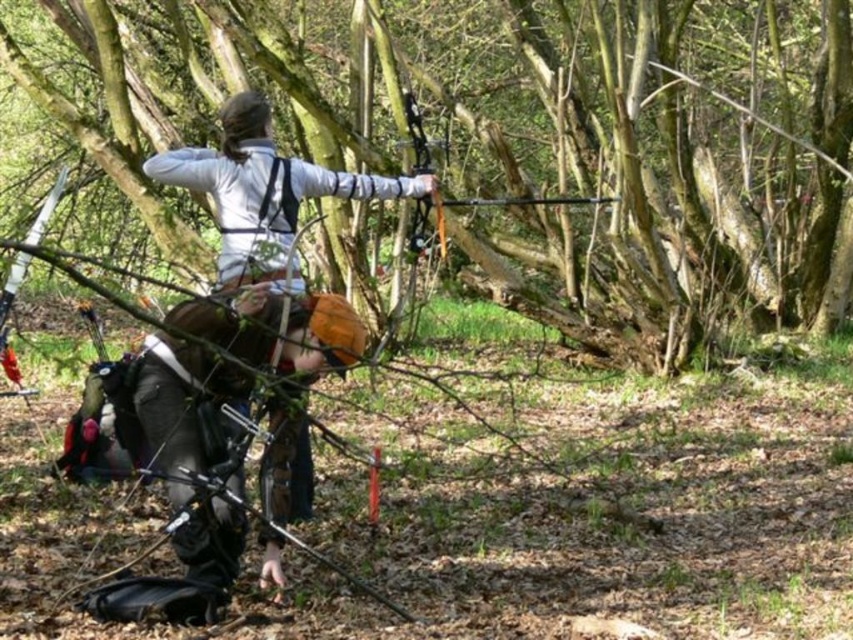
Is rough bark tree at center above matte white jacket at center?

Indeed, rough bark tree at center is positioned over matte white jacket at center.

Identify the location of rough bark tree at center. tap(519, 141).

Measure the distance between brown leather backpack at center and matte black bow at center.

brown leather backpack at center is 2.58 meters away from matte black bow at center.

Is brown leather backpack at center bigger than matte black bow at center?

Correct, brown leather backpack at center is larger in size than matte black bow at center.

What are the coordinates of `brown leather backpack at center` in the screenshot? It's located at (183, 401).

The image size is (853, 640). I want to click on brown leather backpack at center, so (183, 401).

Between brown leather backpack at center and matte white jacket at center, which one appears on the right side from the viewer's perspective?

matte white jacket at center is more to the right.

Does brown leather backpack at center have a greater height compared to matte white jacket at center?

Yes.

Find the location of a particular element. brown leather backpack at center is located at coordinates (183, 401).